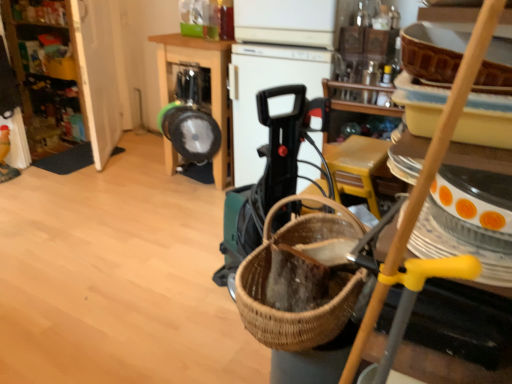
What are the coordinates of `free location to the left of metallic silver frying pan at center` in the screenshot? It's located at (130, 177).